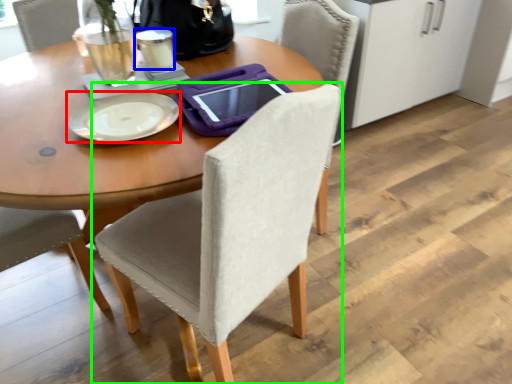
Question: Estimate the real-world distances between objects in this image. Which object is farther from plate (highlighted by a red box), coffee cup (highlighted by a blue box) or chair (highlighted by a green box)?

Choices:
 (A) coffee cup
 (B) chair

Answer: (B)